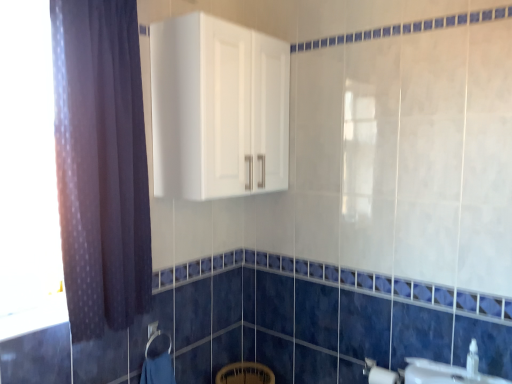
Question: Considering the positions of point (150, 340) and point (134, 130), is point (150, 340) closer or farther from the camera than point (134, 130)?

Choices:
 (A) closer
 (B) farther

Answer: (B)

Question: Which is correct: blue soft towel at lower center is inside dark purple fabric at left, or outside of it?

Choices:
 (A) outside
 (B) inside

Answer: (A)

Question: Which object is the closest to the white glossy cabinet at upper center?

Choices:
 (A) dark purple fabric at left
 (B) white matte toilet paper at lower right
 (C) white glossy sink at lower right
 (D) white plastic soap dispenser at lower right
 (E) blue soft towel at lower center

Answer: (A)

Question: Which is farther from the dark purple fabric at left?

Choices:
 (A) white matte toilet paper at lower right
 (B) white glossy sink at lower right
 (C) white plastic soap dispenser at lower right
 (D) white glossy cabinet at upper center
 (E) blue soft towel at lower center

Answer: (C)